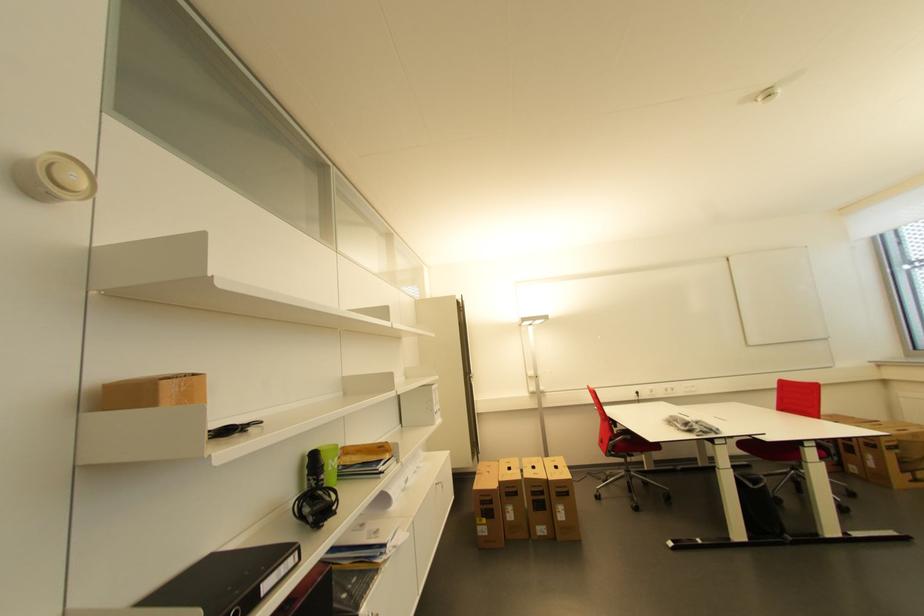
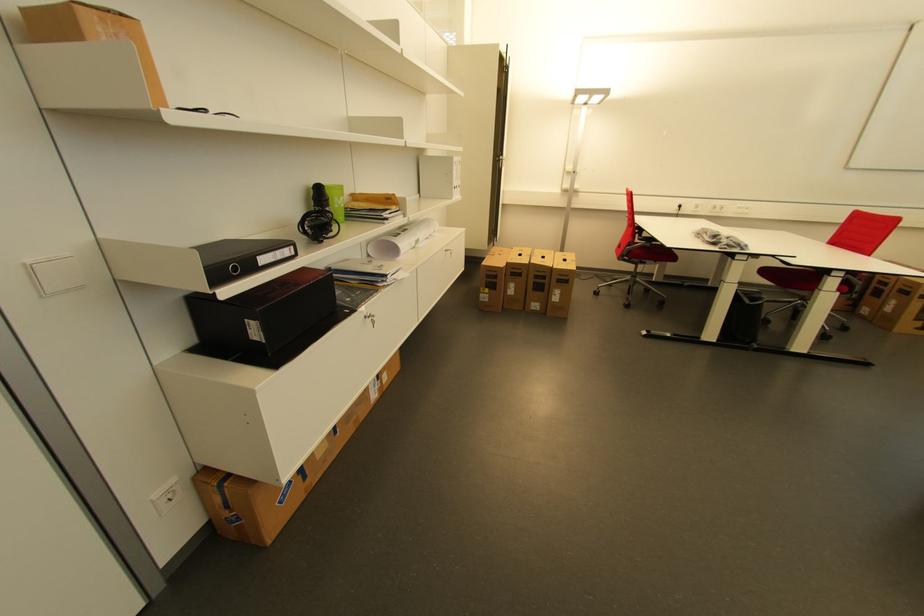
The point at [615,451] is marked in the first image. Where is the corresponding point in the second image?

(629, 254)